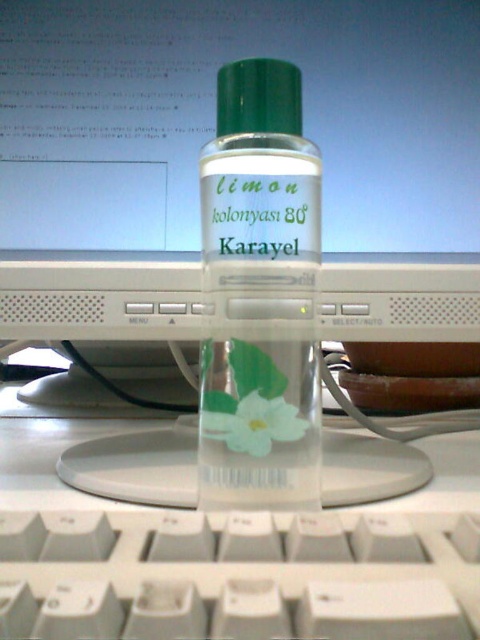
You are trying to place a small decorative item on your desk. You have a white paper flower at center and a white plastic keyboard at bottom. Which object is taller and can be used as a base for the item?

The white plastic keyboard at bottom is much taller than the white paper flower at center, so it can be used as a base for the item.

You are a robot trying to navigate between two points on a desk. The first point is at coordinate point (0,582) and the second is at point (307,268). Given that the transparent plastic bottle with a green cap is blocking the path between these points, which point should you move to first to avoid the bottle?

Point (0,582) is in front of point (307,268), so you should move to point (0,582) first to avoid the bottle blocking the path.

You are setting up a workspace and need to place a transparent plastic bottle at center on the white plastic keyboard at bottom. Can you place the bottle directly on the keyboard without it being too far from you?

The white plastic keyboard at bottom is closer to the viewer than the transparent plastic bottle at center, so placing the bottle on the keyboard would position it further away from you than the keyboard itself. If you want the bottle to be closer, you might need to adjust its placement.